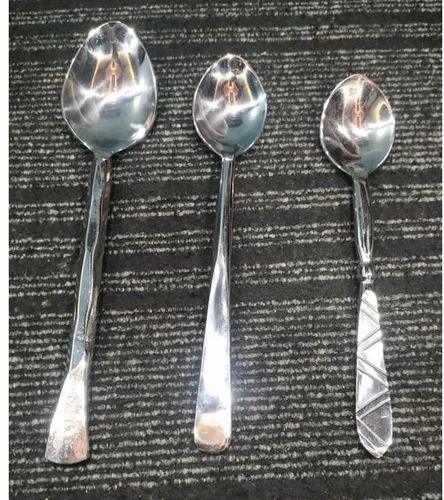
Where is `handle`? handle is located at coordinates (373, 350).